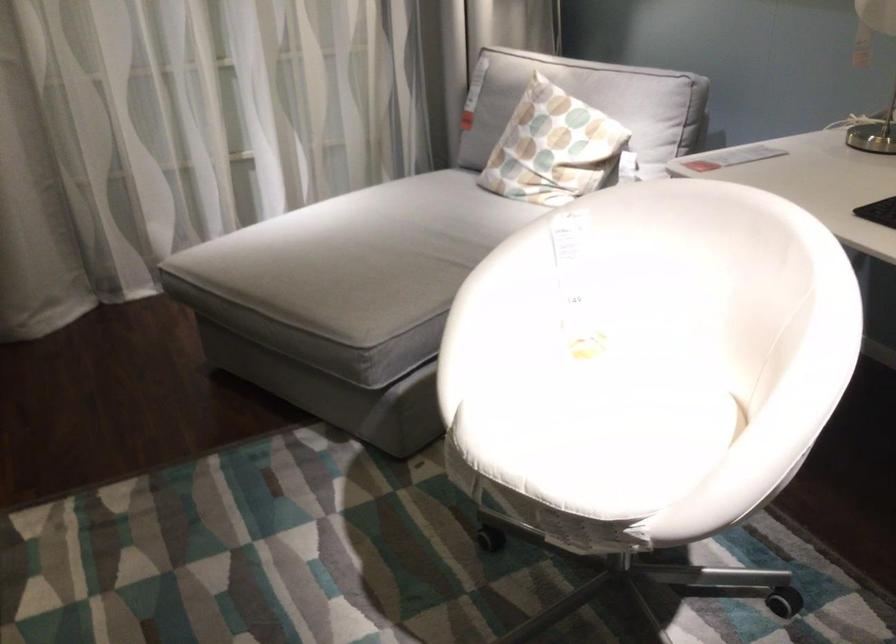
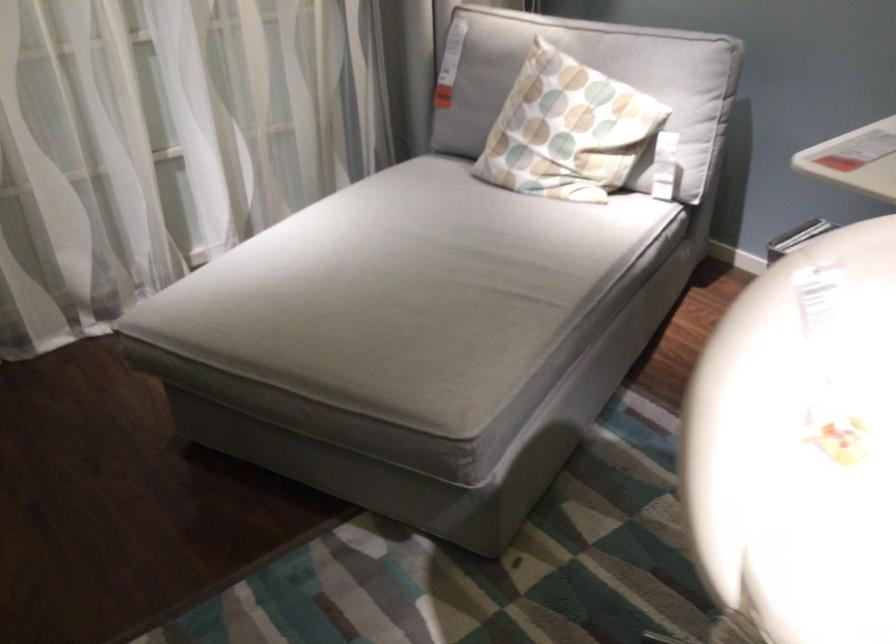
Question: The camera is either moving clockwise (left) or counter-clockwise (right) around the object. The first image is from the beginning of the video and the second image is from the end. Is the camera moving left or right when shooting the video?

Choices:
 (A) Left
 (B) Right

Answer: (A)